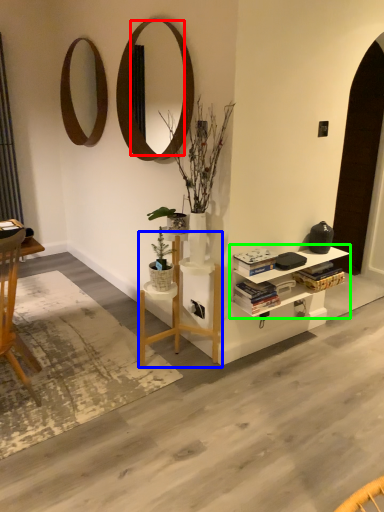
Question: Based on their relative distances, which object is nearer to mirror (highlighted by a red box)? Choose from table (highlighted by a blue box) and shelf (highlighted by a green box).

Choices:
 (A) table
 (B) shelf

Answer: (A)